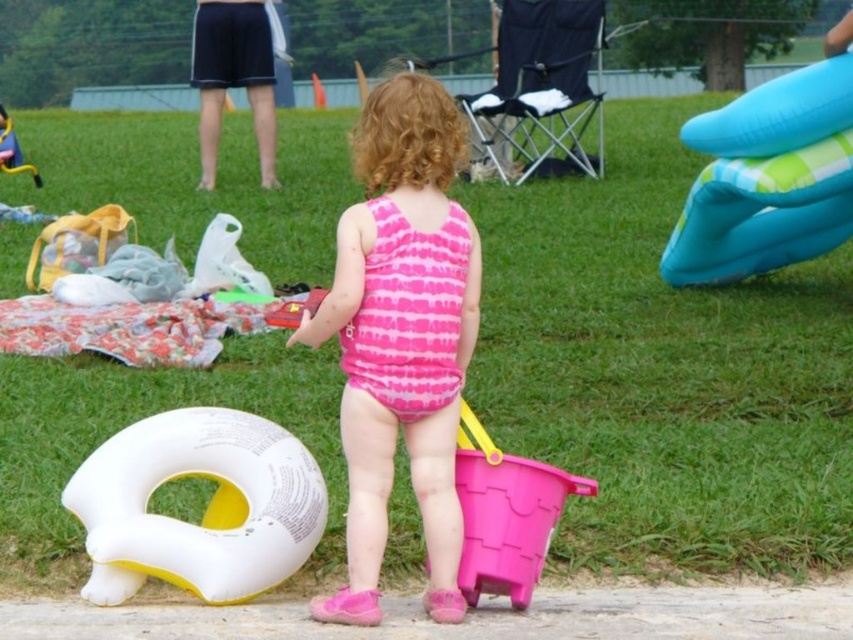
Between blue rubber ring at upper right and pink plastic bucket at lower center, which one is positioned higher?

blue rubber ring at upper right is higher up.

Find the location of `blue rubber ring at upper right`. blue rubber ring at upper right is located at coordinates (767, 179).

Between point (437, 600) and point (480, 490), which one is positioned behind?

The point (480, 490) is behind.

Where is `pink tie-dye swimsuit at center`? This screenshot has width=853, height=640. pink tie-dye swimsuit at center is located at coordinates (401, 336).

Is point (368, 268) closer to camera compared to point (498, 460)?

Yes, point (368, 268) is in front of point (498, 460).

Identify the location of pink tie-dye swimsuit at center. The height and width of the screenshot is (640, 853). [x=401, y=336].

Is white rubber ring at lower left bigger than blue rubber ring at upper right?

No, white rubber ring at lower left is not bigger than blue rubber ring at upper right.

Between white rubber ring at lower left and blue rubber ring at upper right, which one is positioned higher?

Positioned higher is blue rubber ring at upper right.

Who is more forward, (235,522) or (815,253)?

Point (235,522) is in front.

Locate an element on the screen. white rubber ring at lower left is located at coordinates (206, 508).